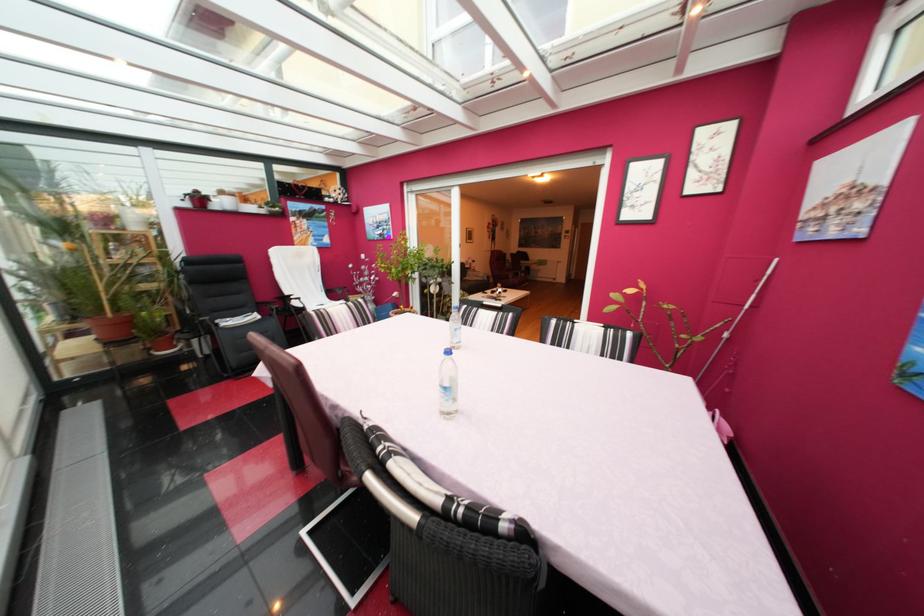
Where would you sit the white chair sitting surface? Please return your answer as a coordinate pair (x, y).

(322, 305)